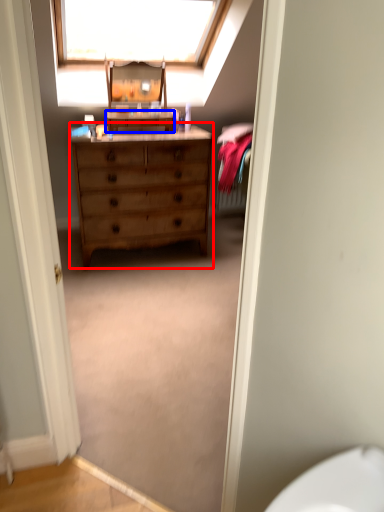
Question: Which object appears closest to the camera in this image, chest of drawers (highlighted by a red box) or cabinetry (highlighted by a blue box)?

Choices:
 (A) chest of drawers
 (B) cabinetry

Answer: (A)